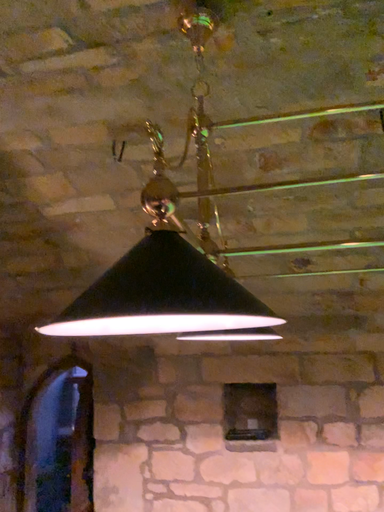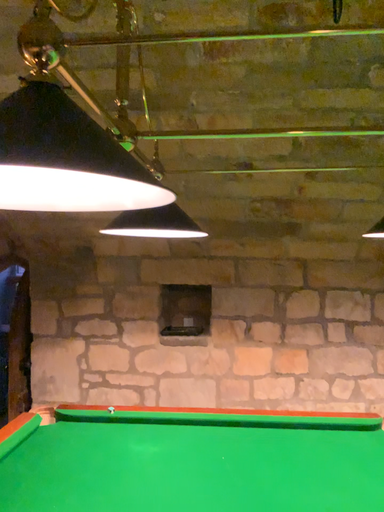
Question: Which way did the camera rotate in the video?

Choices:
 (A) rotated upward
 (B) rotated downward

Answer: (B)